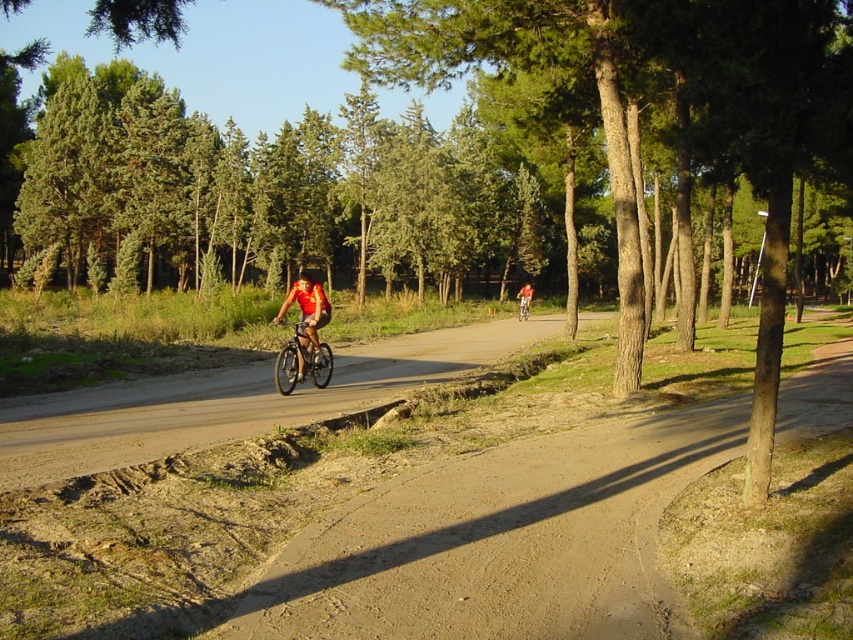
You are standing at the starting point of the dirt path and want to locate the matte black bicycle at center. According to the coordinates provided, in which direction should you walk to find it?

The matte black bicycle at center is located at coordinates point (523, 305). Since the coordinate system typically uses (0, 0) as the bottom left corner and (852, 639) as the top right corner, you should walk towards the upper right direction from your current position at the starting point to reach the matte black bicycle at center.

You are a delivery person who needs to carry a large package. You see a matte black bicycle at center and a black matte bicycle helmet at center. Which item can you attach the package to?

The matte black bicycle at center occupies less space than the black matte bicycle helmet at center, so you should attach the package to the matte black bicycle at center since it has more space available.

You are a cyclist planning to ride along the path shown in the image. You notice the matte black bicycle at center and the black matte bicycle helmet at center. Which object is closer to you as you start your ride?

The matte black bicycle at center is closer to you than the black matte bicycle helmet at center, so the matte black bicycle at center would be closer as you start your ride.